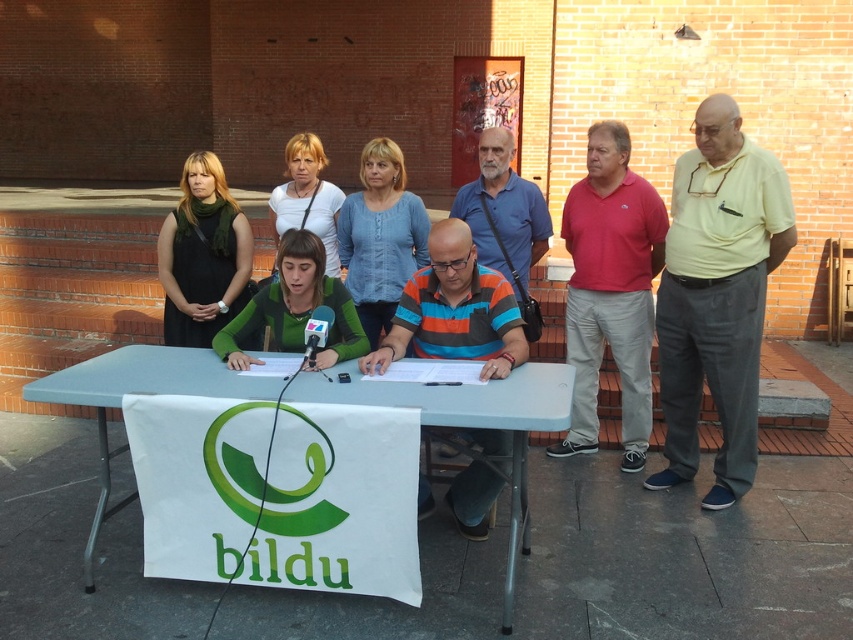
Question: Which point is farther to the camera?

Choices:
 (A) (567, 240)
 (B) (258, 362)
 (C) (722, 291)
 (D) (296, 220)

Answer: (D)

Question: From the image, what is the correct spatial relationship of matte white shirt at center in relation to metallic silver microphone at center?

Choices:
 (A) above
 (B) below

Answer: (A)

Question: Which object is positioned closest to the striped cotton shirt at center?

Choices:
 (A) green matte shirt at center
 (B) metallic silver microphone at center
 (C) matte black dress at left

Answer: (B)

Question: Which point appears closest to the camera in this image?

Choices:
 (A) (213, 275)
 (B) (480, 476)
 (C) (405, 193)
 (D) (315, 333)

Answer: (D)

Question: Considering the relative positions of green matte shirt at center and metallic silver microphone at center in the image provided, where is green matte shirt at center located with respect to metallic silver microphone at center?

Choices:
 (A) below
 (B) above

Answer: (B)

Question: Can you confirm if matte black dress at left is thinner than metallic silver microphone at center?

Choices:
 (A) yes
 (B) no

Answer: (B)